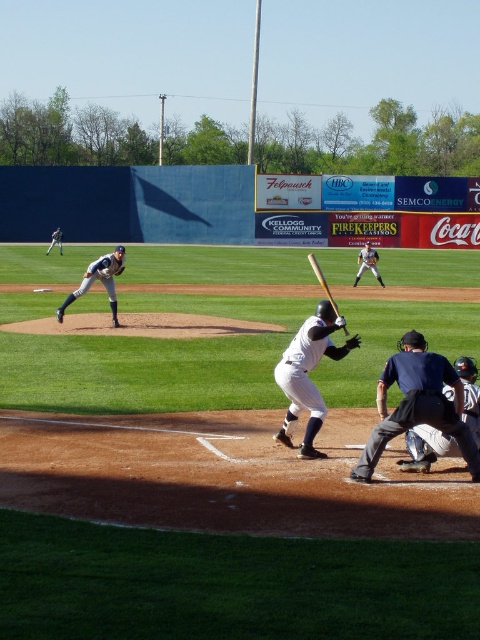
Can you confirm if white matte baseball bat at center is bigger than brown leather glove at lower center?

Indeed, white matte baseball bat at center has a larger size compared to brown leather glove at lower center.

Is white matte baseball bat at center further to the viewer compared to brown leather glove at lower center?

No, it is in front of brown leather glove at lower center.

Consider the image. Measure the distance between white matte baseball bat at center and camera.

white matte baseball bat at center and camera are 8.39 meters apart from each other.

Locate an element on the screen. white matte baseball bat at center is located at coordinates (307, 374).

Is white uniformed pitcher at center thinner than white uniformed pitcher at left?

Indeed, white uniformed pitcher at center has a lesser width compared to white uniformed pitcher at left.

Based on the photo, does white uniformed pitcher at center appear under white uniformed pitcher at left?

Yes, white uniformed pitcher at center is below white uniformed pitcher at left.

The height and width of the screenshot is (640, 480). I want to click on white uniformed pitcher at center, so click(x=98, y=280).

Between black mesh umpire at lower right and brown leather glove at lower center, which one appears on the left side from the viewer's perspective?

From the viewer's perspective, brown leather glove at lower center appears more on the left side.

Where is `black mesh umpire at lower right`? The width and height of the screenshot is (480, 640). black mesh umpire at lower right is located at coordinates (418, 404).

Who is more forward, (386, 433) or (347, 342)?

Point (386, 433) is in front.

In order to click on black mesh umpire at lower right in this screenshot , I will do `click(418, 404)`.